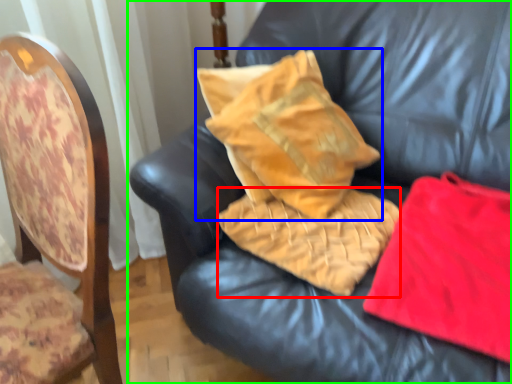
Question: Based on their relative distances, which object is nearer to material (highlighted by a red box)? Choose from pillow (highlighted by a blue box) and furniture (highlighted by a green box).

Choices:
 (A) pillow
 (B) furniture

Answer: (A)